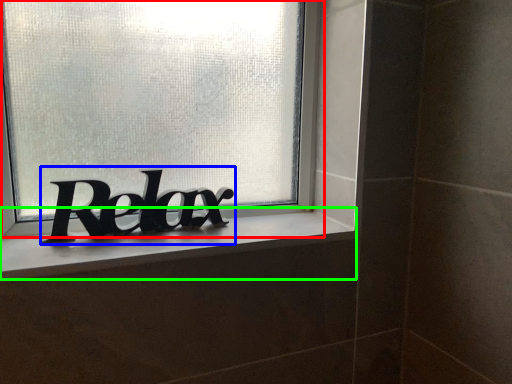
Question: Which is farther away from window (highlighted by a red box)? lettering (highlighted by a blue box) or window sill (highlighted by a green box)?

Choices:
 (A) lettering
 (B) window sill

Answer: (B)